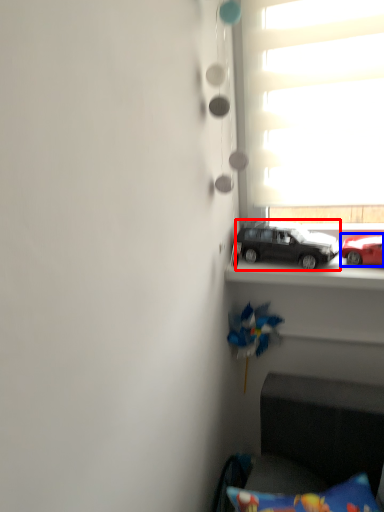
Question: Which of the following is the closest to the observer, car (highlighted by a red box) or car (highlighted by a blue box)?

Choices:
 (A) car
 (B) car

Answer: (B)